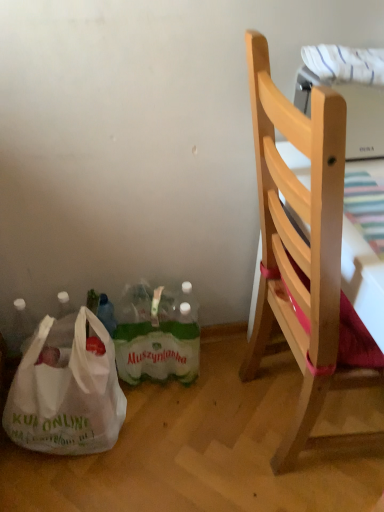
The height and width of the screenshot is (512, 384). Identify the location of free space that is in between natural wood chair at right and white plastic bag at lower left. (178, 431).